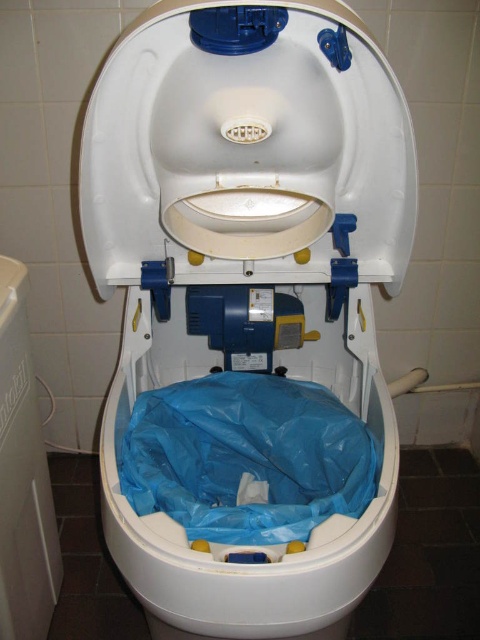
You are standing in front of the toilet system and need to place a new blue plastic liner into the bowl. Where exactly should you position the liner relative to the white plastic toilet seat at center?

The white plastic toilet seat at center is located at point (x=479, y=639). You should place the new blue plastic liner centered around this coordinate to ensure proper alignment with the toilet bowl.

You are a maintenance technician inspecting the toilet system. You notice two points marked as point 1 at coordinates point (235, 593) and point 2 at coordinates point (215, 417). Which point is closer to you when standing directly in front of the toilet?

Point (235, 593) is closer to the viewer than point (215, 417).

You are a maintenance worker checking the compact toilet system. The standard distance between the toilet and its seat should be 3 inches. Based on the image, is the current distance between the white plastic toilet at center and the white plastic toilet seat at center within the acceptable range?

The white plastic toilet at center and white plastic toilet seat at center are 2.83 inches apart, which is slightly less than the required 3 inches. The distance is just below the acceptable range, so it may need adjustment.